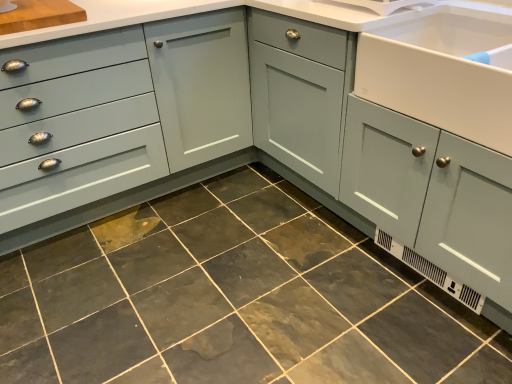
What is the approximate height of white glossy sink at right?

white glossy sink at right is 11.01 inches tall.

Where is `matte gray drawer at left`? matte gray drawer at left is located at coordinates (76, 124).

Considering the sizes of dark gray stone tile at center and matte gray drawer at left in the image, is dark gray stone tile at center bigger or smaller than matte gray drawer at left?

Clearly, dark gray stone tile at center is smaller in size than matte gray drawer at left.

Which object is thinner, dark gray stone tile at center or matte gray drawer at left?

With smaller width is matte gray drawer at left.

Between dark gray stone tile at center and matte gray drawer at left, which one has more height?

matte gray drawer at left is taller.

Considering the relative positions of white glossy sink at right and matte gray drawer at left in the image provided, is white glossy sink at right to the right of matte gray drawer at left from the viewer's perspective?

Correct, you'll find white glossy sink at right to the right of matte gray drawer at left.

From a real-world perspective, is white glossy sink at right physically located above or below matte gray drawer at left?

In terms of real-world spatial position, white glossy sink at right is above matte gray drawer at left.

At what (x,y) coordinates should I click in order to perform the action: click on sink in front of the matte gray drawer at left. Please return your answer as a coordinate pair (x, y). The height and width of the screenshot is (384, 512). Looking at the image, I should click on (443, 69).

Considering the relative positions of white glossy sink at right and matte gray drawer at left in the image provided, is white glossy sink at right in front of matte gray drawer at left?

That is True.

Would you say matte gray drawer at left is outside dark gray stone tile at center?

Absolutely, matte gray drawer at left is external to dark gray stone tile at center.

Which object is wider, matte gray drawer at left or dark gray stone tile at center?

dark gray stone tile at center.

Considering the positions of objects matte gray drawer at left and dark gray stone tile at center in the image provided, who is more to the left, matte gray drawer at left or dark gray stone tile at center?

From the viewer's perspective, matte gray drawer at left appears more on the left side.

Which of these two, matte gray drawer at left or dark gray stone tile at center, is bigger?

Bigger between the two is matte gray drawer at left.

Is matte gray drawer at left located outside white glossy sink at right?

Indeed, matte gray drawer at left is completely outside white glossy sink at right.

Can you confirm if matte gray drawer at left is positioned to the left of white glossy sink at right?

Yes, matte gray drawer at left is to the left of white glossy sink at right.

From a real-world perspective, is matte gray drawer at left beneath white glossy sink at right?

Yes.

You are a GUI agent. You are given a task and a screenshot of the screen. Output one action in this format:
    pyautogui.click(x=<x>, y=<y>)
    Task: Click on the sink above the matte gray drawer at left (from the image's perspective)
    
    Given the screenshot: What is the action you would take?
    pyautogui.click(x=443, y=69)

Locate an element on the screen. The image size is (512, 384). sink on the right of dark gray stone tile at center is located at coordinates (443, 69).

Choose the correct answer: Is dark gray stone tile at center inside white glossy sink at right or outside it?

The correct answer is: outside.

From the image's perspective, does dark gray stone tile at center appear lower than white glossy sink at right?

Yes, from the image's perspective, dark gray stone tile at center is beneath white glossy sink at right.

Consider the image. Considering the relative sizes of dark gray stone tile at center and white glossy sink at right in the image provided, is dark gray stone tile at center wider than white glossy sink at right?

Yes, dark gray stone tile at center is wider than white glossy sink at right.

Consider the image. Looking at the image, does white glossy sink at right seem bigger or smaller compared to dark gray stone tile at center?

white glossy sink at right is smaller than dark gray stone tile at center.

From a real-world perspective, is white glossy sink at right positioned under dark gray stone tile at center based on gravity?

Actually, white glossy sink at right is physically above dark gray stone tile at center in the real world.

Between white glossy sink at right and dark gray stone tile at center, which one has smaller width?

white glossy sink at right.

The width and height of the screenshot is (512, 384). In order to click on ceramic tile below the white glossy sink at right (from a real-world perspective) in this screenshot , I will do `click(233, 299)`.

Where is `ceramic tile on the right of matte gray drawer at left`? ceramic tile on the right of matte gray drawer at left is located at coordinates (233, 299).

You are a GUI agent. You are given a task and a screenshot of the screen. Output one action in this format:
    pyautogui.click(x=<x>, y=<y>)
    Task: Click on the sink in front of the matte gray drawer at left
    This screenshot has height=384, width=512.
    Given the screenshot: What is the action you would take?
    [443, 69]

Considering their positions, is matte gray drawer at left positioned closer to dark gray stone tile at center than white glossy sink at right?

matte gray drawer at left is closer to dark gray stone tile at center.

Estimate the real-world distances between objects in this image. Which object is closer to dark gray stone tile at center, white glossy sink at right or matte gray drawer at left?

matte gray drawer at left.

Which object lies further to the anchor point matte gray drawer at left, dark gray stone tile at center or white glossy sink at right?

white glossy sink at right is positioned further to the anchor matte gray drawer at left.

Looking at this image, estimate the real-world distances between objects in this image. Which object is further from white glossy sink at right, dark gray stone tile at center or matte gray drawer at left?

matte gray drawer at left is further to white glossy sink at right.

Looking at the image, which one is located closer to white glossy sink at right, matte gray drawer at left or dark gray stone tile at center?

dark gray stone tile at center lies closer to white glossy sink at right than the other object.

Estimate the real-world distances between objects in this image. Which object is closer to matte gray drawer at left, white glossy sink at right or dark gray stone tile at center?

dark gray stone tile at center.

You are a GUI agent. You are given a task and a screenshot of the screen. Output one action in this format:
    pyautogui.click(x=<x>, y=<y>)
    Task: Click on the ceramic tile between matte gray drawer at left and white glossy sink at right
    Image resolution: width=512 pixels, height=384 pixels.
    Given the screenshot: What is the action you would take?
    pyautogui.click(x=233, y=299)